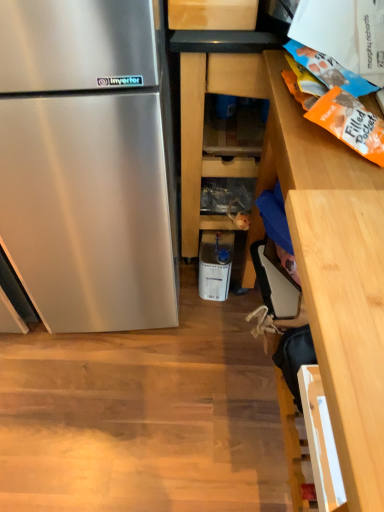
Question: Is wooden cabinet at right, arranged as the first cabinetry when viewed from the right, spatially inside white plastic container at center, or outside of it?

Choices:
 (A) inside
 (B) outside

Answer: (B)

Question: Is wooden cabinet at right, which is counted as the second cabinetry, starting from the left, wider or thinner than white plastic container at center?

Choices:
 (A) thin
 (B) wide

Answer: (B)

Question: Which of these objects is positioned farthest from the white plastic container at center?

Choices:
 (A) wooden shelves at center, arranged as the 1th cabinetry when viewed from the left
 (B) wooden cabinet at right, which is counted as the second cabinetry, starting from the left

Answer: (B)

Question: Which object is the farthest from the wooden cabinet at right, which is counted as the second cabinetry, starting from the left?

Choices:
 (A) white plastic container at center
 (B) wooden shelves at center, arranged as the 1th cabinetry when viewed from the left

Answer: (A)